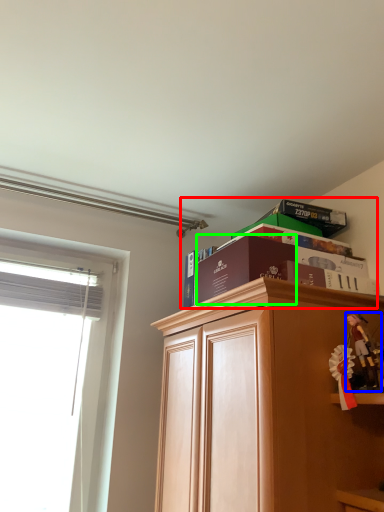
Question: Which is farther away from book (highlighted by a red box)? toy (highlighted by a blue box) or paperback book (highlighted by a green box)?

Choices:
 (A) toy
 (B) paperback book

Answer: (A)